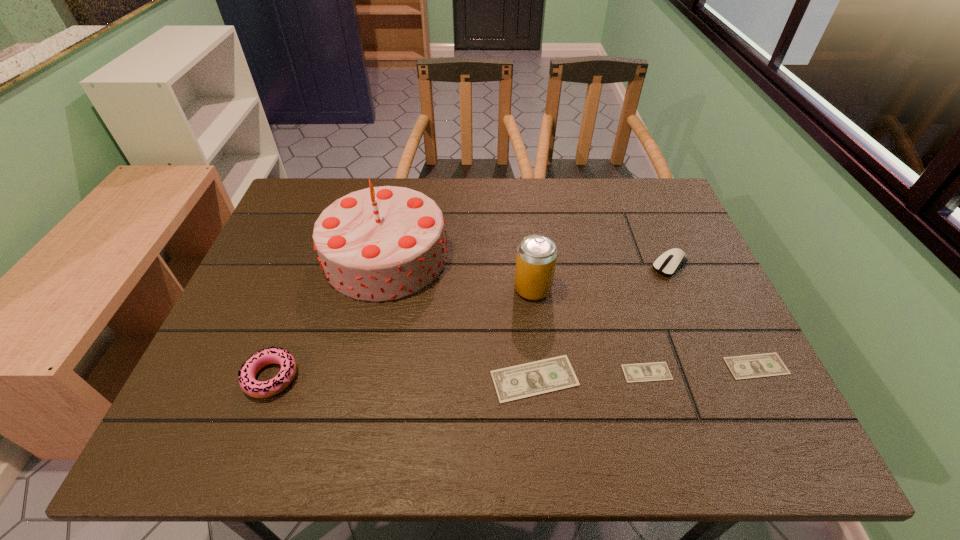
Please show where to add a money on the left while keeping spacing even. Please provide its 2D coordinates. Your answer should be formatted as a tuple, i.e. [(x, y)], where the tuple contains the x and y coordinates of a point satisfying the conditions above.

[(420, 385)]